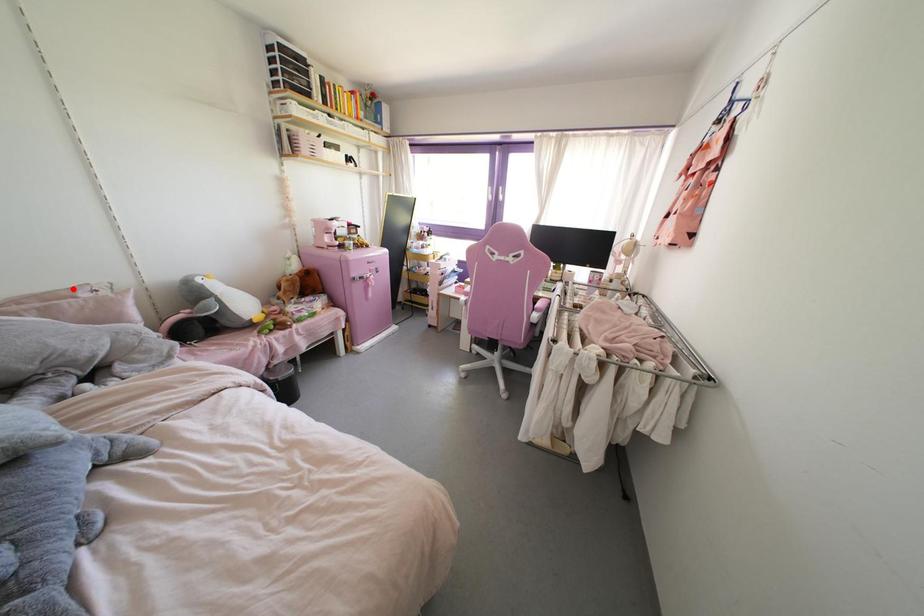
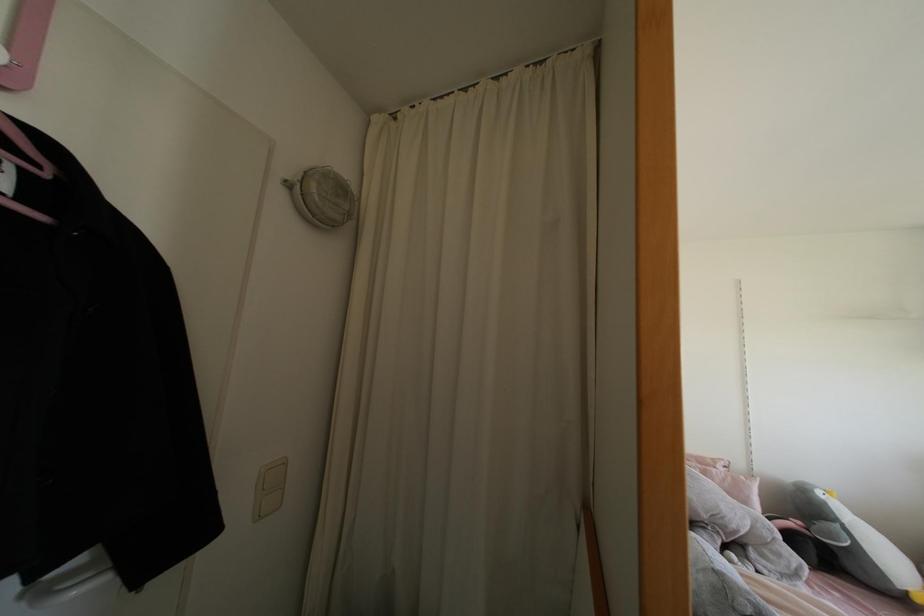
Question: I am providing you with two images of the same scene from different viewpoints. A red point is marked on the first image. Is the red point's position out of view in image 2?

Choices:
 (A) Yes
 (B) No

Answer: (B)